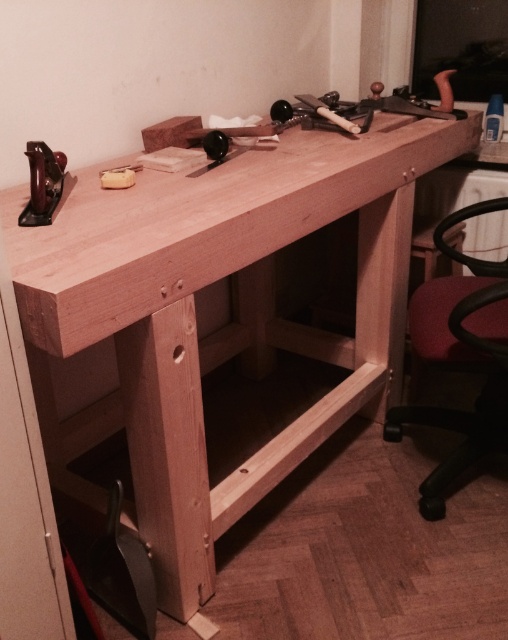
Which is more to the left, natural wood counter top at center or matte black plane at left?

From the viewer's perspective, matte black plane at left appears more on the left side.

Is natural wood counter top at center above matte black plane at left?

No.

Which is behind, point (427, 148) or point (55, 160)?

Positioned behind is point (427, 148).

In order to click on natural wood counter top at center in this screenshot , I will do `click(227, 230)`.